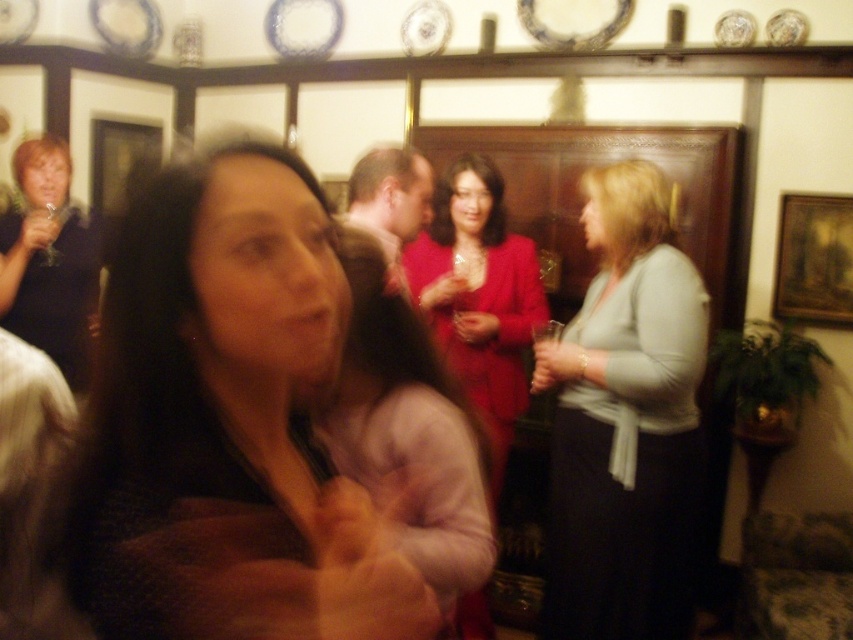
Question: Is light gray sweater at center below matte red dress at center?

Choices:
 (A) yes
 (B) no

Answer: (A)

Question: Can you confirm if matte red dress at center is positioned below matte black dress at left?

Choices:
 (A) yes
 (B) no

Answer: (A)

Question: Which object is the closest to the matte black dress at left?

Choices:
 (A) dark brown hair at center
 (B) matte red dress at center
 (C) light gray sweater at center

Answer: (B)

Question: Can you confirm if light gray sweater at center is bigger than matte black dress at left?

Choices:
 (A) yes
 (B) no

Answer: (A)

Question: Which point is closer to the camera?

Choices:
 (A) (44, 296)
 (B) (318, 433)

Answer: (B)

Question: Which object is the farthest from the matte black dress at left?

Choices:
 (A) matte pink sweater at center
 (B) matte red dress at center
 (C) light gray sweater at center
 (D) wooden framed painting at upper right

Answer: (D)